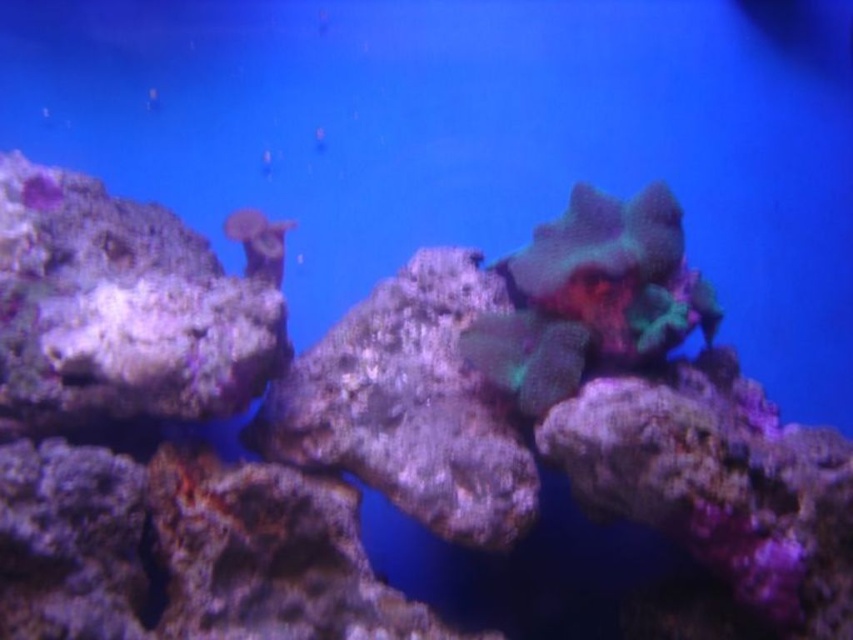
Can you confirm if rough textured rock at center is thinner than translucent coral at upper center?

In fact, rough textured rock at center might be wider than translucent coral at upper center.

Describe the element at coordinates (409, 404) in the screenshot. I see `rough textured rock at center` at that location.

Is point (480, 540) closer to viewer compared to point (248, 227)?

Yes, it is.

Identify the location of rough textured rock at center. (409, 404).

Who is more distant from viewer, (274, 428) or (689, 298)?

Positioned behind is point (274, 428).

Between rough textured rock at center and green coral at center, which one appears on the right side from the viewer's perspective?

green coral at center

Locate an element on the screen. This screenshot has width=853, height=640. rough textured rock at center is located at coordinates (409, 404).

Who is shorter, green coral at center or translucent coral at upper center?

translucent coral at upper center

Does green coral at center have a lesser height compared to translucent coral at upper center?

In fact, green coral at center may be taller than translucent coral at upper center.

What do you see at coordinates (592, 296) in the screenshot?
I see `green coral at center` at bounding box center [592, 296].

Identify the location of green coral at center. The height and width of the screenshot is (640, 853). (592, 296).